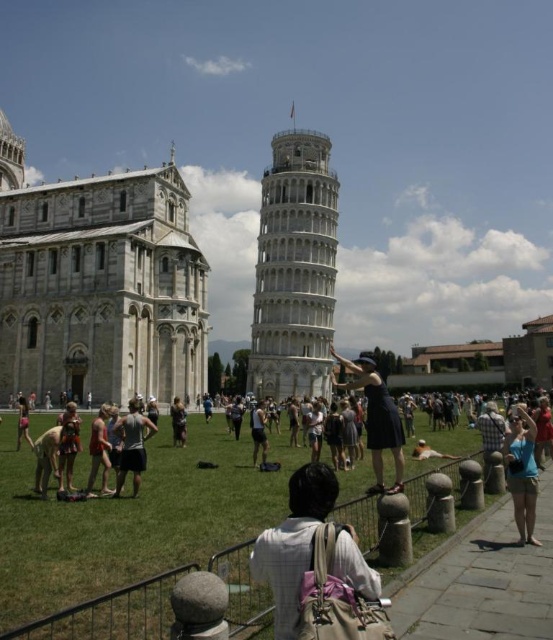
Question: Which object is closer to the camera taking this photo?

Choices:
 (A) white marble cathedral at upper left
 (B) dark gray fabric shorts at center

Answer: (B)

Question: Is white marble cathedral at upper left wider than white marble tower at center?

Choices:
 (A) no
 (B) yes

Answer: (B)

Question: Is white marble cathedral at upper left wider than light gray backpack at center?

Choices:
 (A) yes
 (B) no

Answer: (A)

Question: Does white marble tower at center have a greater width compared to dark gray fabric shorts at center?

Choices:
 (A) no
 (B) yes

Answer: (B)

Question: Which object appears closest to the camera in this image?

Choices:
 (A) dark blue dress at center
 (B) white marble cathedral at upper left
 (C) blue denim shorts at lower right

Answer: (C)

Question: Among these points, which one is nearest to the camera?

Choices:
 (A) (140, 244)
 (B) (133, 474)
 (C) (357, 572)
 (D) (385, 490)

Answer: (C)